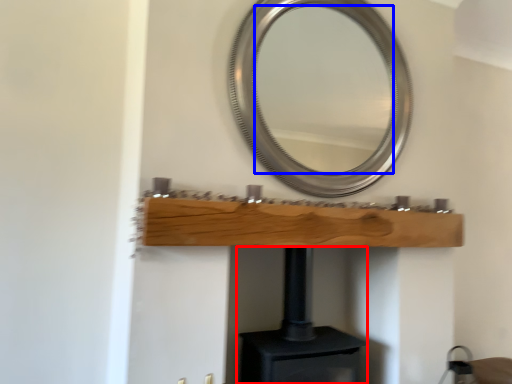
Question: Which of the following is the closest to the observer, fireplace (highlighted by a red box) or mirror (highlighted by a blue box)?

Choices:
 (A) fireplace
 (B) mirror

Answer: (A)